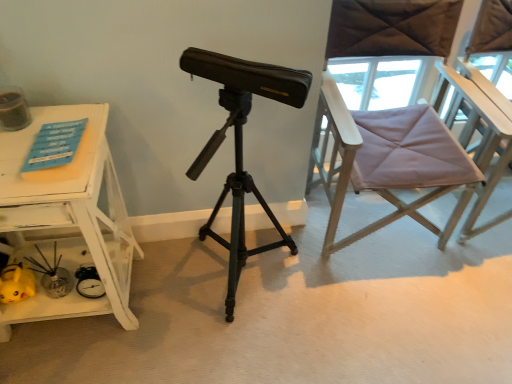
Where is `white painted wood table at left`? Image resolution: width=512 pixels, height=384 pixels. white painted wood table at left is located at coordinates (69, 219).

Does matte black tripod at center turn towards purple fabric chair at right?

No, matte black tripod at center is not turned towards purple fabric chair at right.

Can you tell me how much matte black tripod at center and purple fabric chair at right differ in facing direction?

0.581 degrees separate the facing orientations of matte black tripod at center and purple fabric chair at right.

Is matte black tripod at center completely or partially outside of purple fabric chair at right?

Indeed, matte black tripod at center is completely outside purple fabric chair at right.

From a real-world perspective, is matte black tripod at center physically below purple fabric chair at right?

Indeed, from a real-world perspective, matte black tripod at center is positioned beneath purple fabric chair at right.

Is matte black tripod at center a part of white painted wood table at left?

No, matte black tripod at center is not surrounded by white painted wood table at left.

Measure the distance between white painted wood table at left and matte black tripod at center.

They are 15.89 inches apart.

From a real-world perspective, does white painted wood table at left sit lower than matte black tripod at center?

Yes, from a real-world perspective, white painted wood table at left is below matte black tripod at center.

Which object is thinner, white painted wood table at left or matte black tripod at center?

Thinner between the two is white painted wood table at left.

Who is shorter, purple fabric chair at right or white painted wood table at left?

white painted wood table at left is shorter.

Do you think purple fabric chair at right is within white painted wood table at left, or outside of it?

purple fabric chair at right cannot be found inside white painted wood table at left.

Considering the sizes of purple fabric chair at right and white painted wood table at left in the image, is purple fabric chair at right bigger or smaller than white painted wood table at left?

Considering their sizes, purple fabric chair at right takes up more space than white painted wood table at left.

Can you tell me how much purple fabric chair at right and white painted wood table at left differ in facing direction?

purple fabric chair at right and white painted wood table at left are facing 0.581 degrees away from each other.

In the scene shown: Considering the sizes of purple fabric chair at right and matte black tripod at center in the image, is purple fabric chair at right taller or shorter than matte black tripod at center?

Considering their sizes, purple fabric chair at right has less height than matte black tripod at center.

Find the location of a particular element. This screenshot has width=512, height=384. tripod that is below the purple fabric chair at right (from the image's perspective) is located at coordinates (234, 193).

Which object is positioned more to the left, purple fabric chair at right or matte black tripod at center?

matte black tripod at center is more to the left.

Are purple fabric chair at right and matte black tripod at center beside each other?

No, purple fabric chair at right is not touching matte black tripod at center.

At what (x,y) coordinates should I click in order to perform the action: click on chair on the right of white painted wood table at left. Please return your answer as a coordinate pair (x, y). Image resolution: width=512 pixels, height=384 pixels. Looking at the image, I should click on (352, 170).

Looking at this image, would you say white painted wood table at left is outside purple fabric chair at right?

That's correct, white painted wood table at left is outside of purple fabric chair at right.

Could you tell me if white painted wood table at left is turned towards purple fabric chair at right?

No, white painted wood table at left is not turned towards purple fabric chair at right.

From the image's perspective, would you say white painted wood table at left is positioned over purple fabric chair at right?

Incorrect, from the image's perspective, white painted wood table at left is lower than purple fabric chair at right.

Is point (291, 253) positioned behind point (7, 319)?

Yes, it is behind point (7, 319).

Is matte black tripod at center at the right side of white painted wood table at left?

Yes, matte black tripod at center is to the right of white painted wood table at left.

In terms of size, does matte black tripod at center appear bigger or smaller than white painted wood table at left?

Considering their sizes, matte black tripod at center takes up more space than white painted wood table at left.

This screenshot has width=512, height=384. Find the location of `table behind the matte black tripod at center`. table behind the matte black tripod at center is located at coordinates (69, 219).

Where is `tripod on the left of purple fabric chair at right`? The width and height of the screenshot is (512, 384). tripod on the left of purple fabric chair at right is located at coordinates (234, 193).

The height and width of the screenshot is (384, 512). I want to click on tripod lying above the white painted wood table at left (from the image's perspective), so click(234, 193).

From the image, which object appears to be nearer to white painted wood table at left, matte black tripod at center or purple fabric chair at right?

matte black tripod at center.

Based on their spatial positions, is white painted wood table at left or purple fabric chair at right further from matte black tripod at center?

purple fabric chair at right is positioned further to the anchor matte black tripod at center.

Consider the image. Looking at the image, which one is located closer to purple fabric chair at right, matte black tripod at center or white painted wood table at left?

Among the two, matte black tripod at center is located nearer to purple fabric chair at right.

From the image, which object appears to be farther from matte black tripod at center, purple fabric chair at right or white painted wood table at left?

purple fabric chair at right is further to matte black tripod at center.

Estimate the real-world distances between objects in this image. Which object is further from white painted wood table at left, purple fabric chair at right or matte black tripod at center?

The object further to white painted wood table at left is purple fabric chair at right.

Estimate the real-world distances between objects in this image. Which object is further from purple fabric chair at right, white painted wood table at left or matte black tripod at center?

white painted wood table at left.

At what (x,y) coordinates should I click in order to perform the action: click on tripod between white painted wood table at left and purple fabric chair at right. Please return your answer as a coordinate pair (x, y). Looking at the image, I should click on (234, 193).